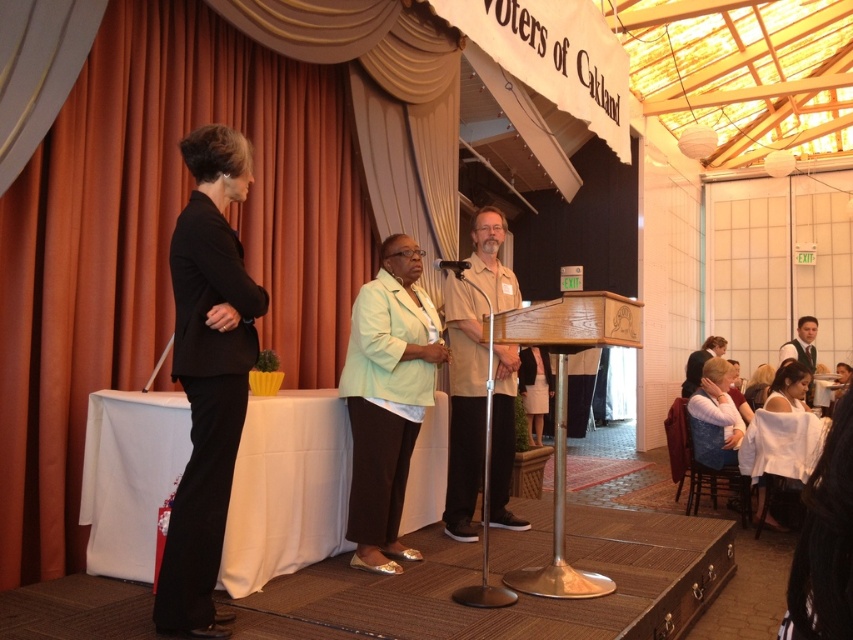
Measure the distance between point (x=236, y=468) and camera.

2.94 meters

At what (x,y) coordinates should I click in order to perform the action: click on orange velvet curtain at upper left. Please return your answer as a coordinate pair (x, y). Looking at the image, I should click on (154, 273).

Who is higher up, mint green fabric jacket at center or beige fabric shirt at center?

beige fabric shirt at center is above.

Based on the photo, which is more to the left, mint green fabric jacket at center or beige fabric shirt at center?

Positioned to the left is mint green fabric jacket at center.

Image resolution: width=853 pixels, height=640 pixels. Find the location of `mint green fabric jacket at center`. mint green fabric jacket at center is located at coordinates (387, 400).

Is black matte suit at left to the right of mint green fabric jacket at center from the viewer's perspective?

No, black matte suit at left is not to the right of mint green fabric jacket at center.

Is black matte suit at left bigger than mint green fabric jacket at center?

No, black matte suit at left is not bigger than mint green fabric jacket at center.

The height and width of the screenshot is (640, 853). Describe the element at coordinates (207, 374) in the screenshot. I see `black matte suit at left` at that location.

This screenshot has width=853, height=640. I want to click on black matte suit at left, so click(x=207, y=374).